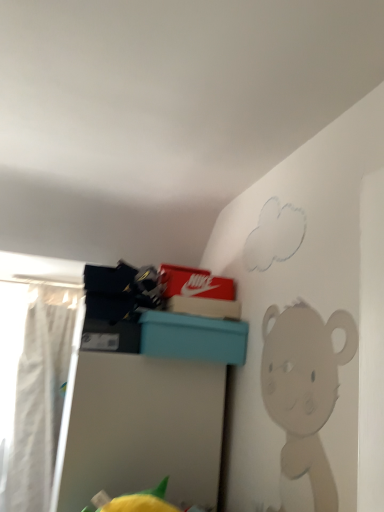
What are the coordinates of `white fabric curtain at left` in the screenshot? It's located at (39, 399).

This screenshot has width=384, height=512. What do you see at coordinates (39, 399) in the screenshot?
I see `white fabric curtain at left` at bounding box center [39, 399].

What is the approximate height of teal plastic storage bin at upper center?

teal plastic storage bin at upper center is 30.94 inches tall.

Image resolution: width=384 pixels, height=512 pixels. What do you see at coordinates (146, 409) in the screenshot?
I see `teal plastic storage bin at upper center` at bounding box center [146, 409].

At what (x,y) coordinates should I click in order to perform the action: click on teal plastic storage bin at upper center. Please return your answer as a coordinate pair (x, y). Looking at the image, I should click on (146, 409).

Locate an element on the screen. This screenshot has width=384, height=512. white fabric curtain at left is located at coordinates coord(39,399).

In the image, is white fabric curtain at left on the left side or the right side of teal plastic storage bin at upper center?

white fabric curtain at left is positioned on teal plastic storage bin at upper center's left side.

Which is behind, white fabric curtain at left or teal plastic storage bin at upper center?

white fabric curtain at left is more distant.

Does point (50, 390) come farther from viewer compared to point (141, 384)?

That is True.

From the image's perspective, which is below, white fabric curtain at left or teal plastic storage bin at upper center?

teal plastic storage bin at upper center appears lower in the image.

From a real-world perspective, is white fabric curtain at left on teal plastic storage bin at upper center?

Yes, from a real-world perspective, white fabric curtain at left is above teal plastic storage bin at upper center.

From the picture: Considering the sizes of white fabric curtain at left and teal plastic storage bin at upper center in the image, is white fabric curtain at left wider or thinner than teal plastic storage bin at upper center?

Considering their sizes, white fabric curtain at left looks slimmer than teal plastic storage bin at upper center.

Considering the relative sizes of white fabric curtain at left and teal plastic storage bin at upper center in the image provided, is white fabric curtain at left shorter than teal plastic storage bin at upper center?

In fact, white fabric curtain at left may be taller than teal plastic storage bin at upper center.

Who is bigger, white fabric curtain at left or teal plastic storage bin at upper center?

Bigger between the two is teal plastic storage bin at upper center.

Looking at this image, is white fabric curtain at left spatially inside teal plastic storage bin at upper center, or outside of it?

white fabric curtain at left is outside teal plastic storage bin at upper center.

Can you see white fabric curtain at left touching teal plastic storage bin at upper center?

No, white fabric curtain at left is not beside teal plastic storage bin at upper center.

Could you tell me if white fabric curtain at left is facing teal plastic storage bin at upper center?

No, white fabric curtain at left is not facing towards teal plastic storage bin at upper center.

What's the angular difference between white fabric curtain at left and teal plastic storage bin at upper center's facing directions?

The angular difference between white fabric curtain at left and teal plastic storage bin at upper center is 90.7 degrees.

Where is `furniture below the white fabric curtain at left (from the image's perspective)`? This screenshot has width=384, height=512. furniture below the white fabric curtain at left (from the image's perspective) is located at coordinates (146, 409).

In the image, is teal plastic storage bin at upper center on the left side or the right side of white fabric curtain at left?

From the image, it's evident that teal plastic storage bin at upper center is to the right of white fabric curtain at left.

Considering their positions, is teal plastic storage bin at upper center located in front of or behind white fabric curtain at left?

In the image, teal plastic storage bin at upper center appears in front of white fabric curtain at left.

Considering the positions of points (196, 402) and (23, 481), is point (196, 402) farther from camera compared to point (23, 481)?

No, it is in front of (23, 481).

From the image's perspective, is teal plastic storage bin at upper center located above or below white fabric curtain at left?

teal plastic storage bin at upper center is below white fabric curtain at left.

From a real-world perspective, is teal plastic storage bin at upper center positioned under white fabric curtain at left based on gravity?

Indeed, from a real-world perspective, teal plastic storage bin at upper center is positioned beneath white fabric curtain at left.

Is teal plastic storage bin at upper center wider than white fabric curtain at left?

Yes, teal plastic storage bin at upper center is wider than white fabric curtain at left.

Is teal plastic storage bin at upper center shorter than white fabric curtain at left?

Correct, teal plastic storage bin at upper center is not as tall as white fabric curtain at left.

Can you confirm if teal plastic storage bin at upper center is smaller than white fabric curtain at left?

Incorrect, teal plastic storage bin at upper center is not smaller in size than white fabric curtain at left.

Can we say teal plastic storage bin at upper center lies outside white fabric curtain at left?

Yes, teal plastic storage bin at upper center is outside of white fabric curtain at left.

From the picture: Is there a large distance between teal plastic storage bin at upper center and white fabric curtain at left?

Yes, teal plastic storage bin at upper center is far from white fabric curtain at left.

Is teal plastic storage bin at upper center positioned with its back to white fabric curtain at left?

No.

How many degrees apart are the facing directions of teal plastic storage bin at upper center and white fabric curtain at left?

They differ by 90.7 degrees in their facing directions.

This screenshot has width=384, height=512. I want to click on curtain behind the teal plastic storage bin at upper center, so click(x=39, y=399).

Identify the location of furniture located below the white fabric curtain at left (from the image's perspective). This screenshot has width=384, height=512. (146, 409).

You are a GUI agent. You are given a task and a screenshot of the screen. Output one action in this format:
    pyautogui.click(x=<x>, y=<y>)
    Task: Click on the curtain that is above the teal plastic storage bin at upper center (from the image's perspective)
    This screenshot has width=384, height=512.
    Given the screenshot: What is the action you would take?
    pyautogui.click(x=39, y=399)